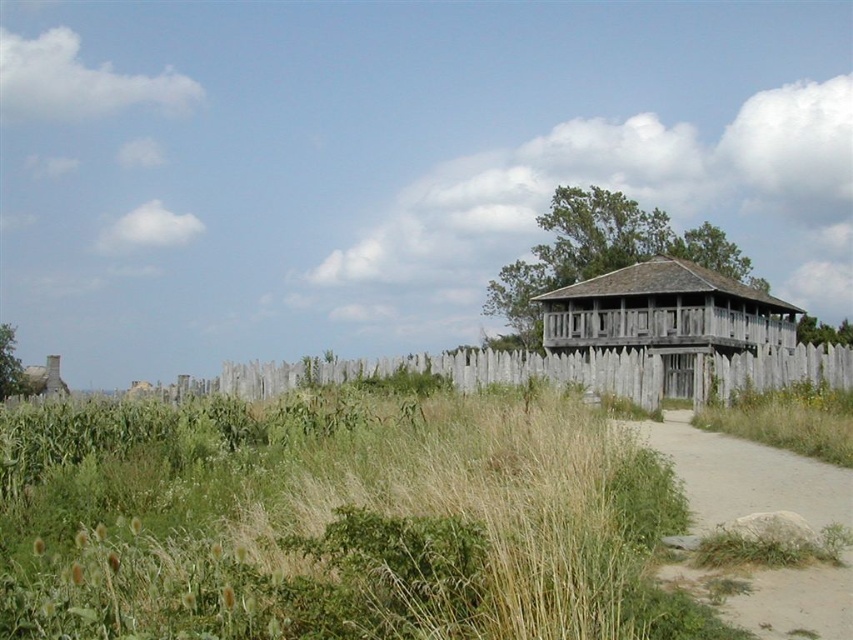
Question: Does green grass at center have a lesser width compared to weathered wood tower at center-right?

Choices:
 (A) yes
 (B) no

Answer: (A)

Question: Can you confirm if green grass at center is smaller than dirt path at lower right?

Choices:
 (A) yes
 (B) no

Answer: (B)

Question: Does dirt path at lower right appear on the right side of weathered wood fence at center?

Choices:
 (A) no
 (B) yes

Answer: (A)

Question: Which object is farther from the camera taking this photo?

Choices:
 (A) green grass at center
 (B) weathered wood tower at center-right
 (C) weathered wood fence at center

Answer: (B)

Question: Which point is closer to the camera?

Choices:
 (A) (663, 440)
 (B) (656, 308)
 (C) (51, 499)
 (D) (752, 353)

Answer: (C)

Question: Which object is positioned closest to the weathered wood fence at center?

Choices:
 (A) weathered wood tower at center-right
 (B) green grass at center

Answer: (A)